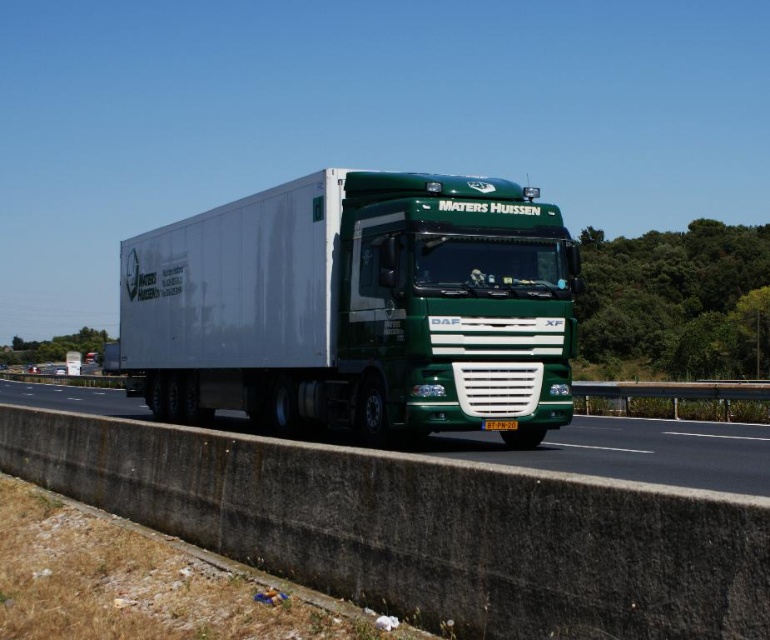
You are a delivery driver who needs to pass under a bridge with a height restriction of 4 meters. The green matte trailer truck at center and the green matte truck at center are both part of your fleet. Which vehicle should you choose to ensure it can safely pass under the bridge?

The green matte truck at center is shorter than the green matte trailer truck at center. Since the trailer truck is taller, you should choose the green matte truck at center to safely pass under the 4 meter height restriction.

You are a driver observing the truck on the highway. Where is the green matte trailer truck located in relation to the point marked at coordinates (357, 308)?

The green matte trailer truck at center is located exactly at the point marked at coordinates (357, 308).